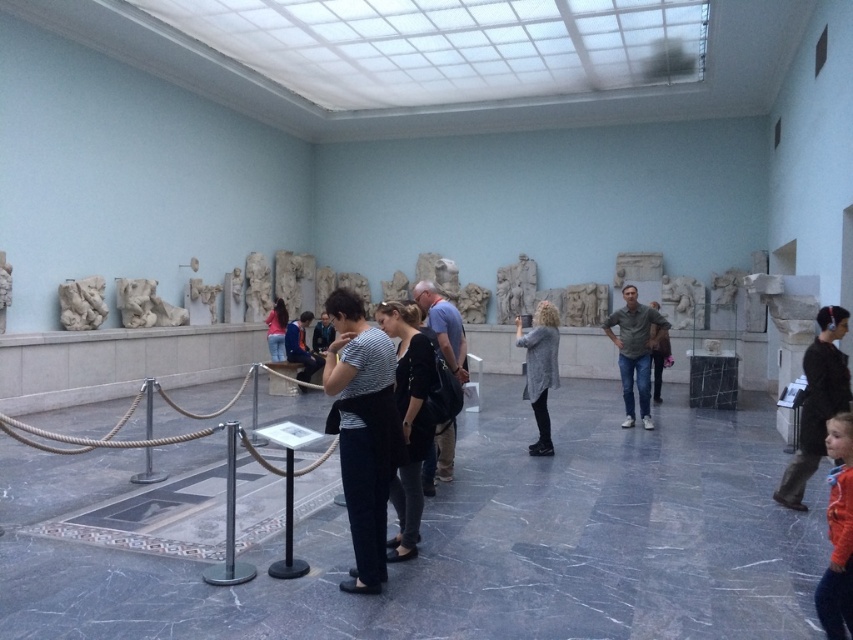
Consider the image. Who is positioned more to the left, gray wool sweater at center or dark gray sweater at center?

From the viewer's perspective, gray wool sweater at center appears more on the left side.

This screenshot has height=640, width=853. What are the coordinates of `gray wool sweater at center` in the screenshot? It's located at (540, 369).

Is point (537, 340) positioned before point (659, 333)?

Yes, it is.

Find the location of a particular element. The image size is (853, 640). gray wool sweater at center is located at coordinates (540, 369).

Does point (634, 314) come closer to viewer compared to point (323, 332)?

Yes, it is in front of point (323, 332).

Find the location of `gray cotton shirt at center`. gray cotton shirt at center is located at coordinates (635, 349).

Find the location of `gray cotton shirt at center`. gray cotton shirt at center is located at coordinates (635, 349).

Is blue cotton shirt at center taller than dark gray sweater at center?

Incorrect, blue cotton shirt at center's height is not larger of dark gray sweater at center's.

Is point (422, 296) in front of point (664, 337)?

Yes, it is in front of point (664, 337).

You are a GUI agent. You are given a task and a screenshot of the screen. Output one action in this format:
    pyautogui.click(x=<x>, y=<y>)
    Task: Click on the blue cotton shirt at center
    The height and width of the screenshot is (640, 853).
    Given the screenshot: What is the action you would take?
    [444, 326]